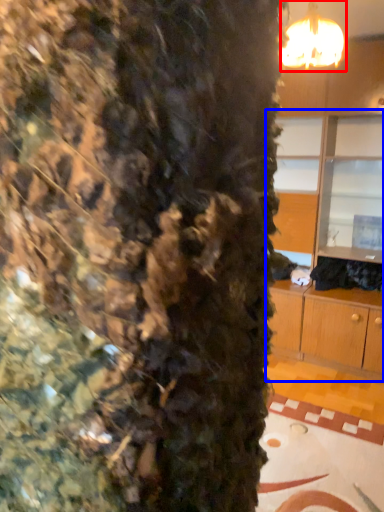
Question: Which object is further to the camera taking this photo, lamp (highlighted by a red box) or dresser (highlighted by a blue box)?

Choices:
 (A) lamp
 (B) dresser

Answer: (B)